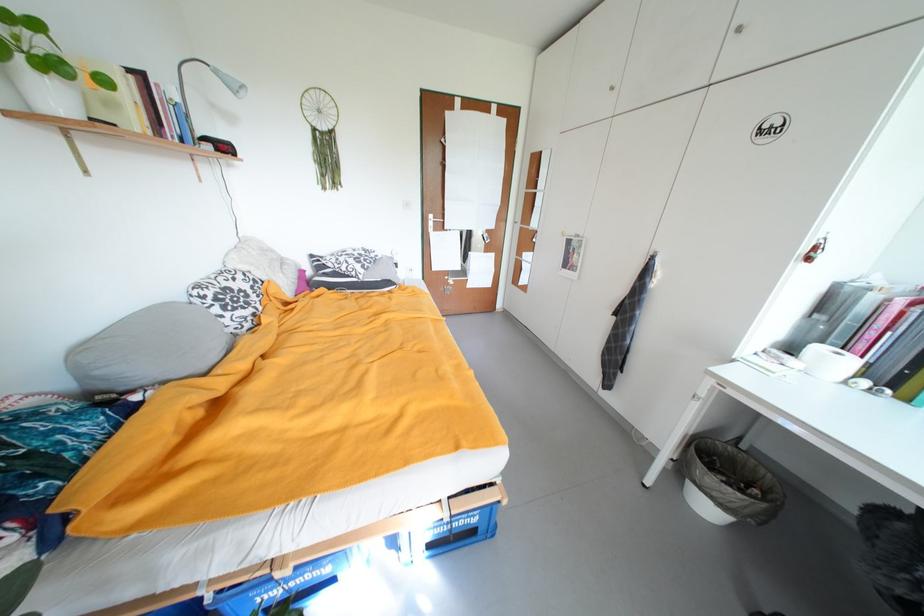
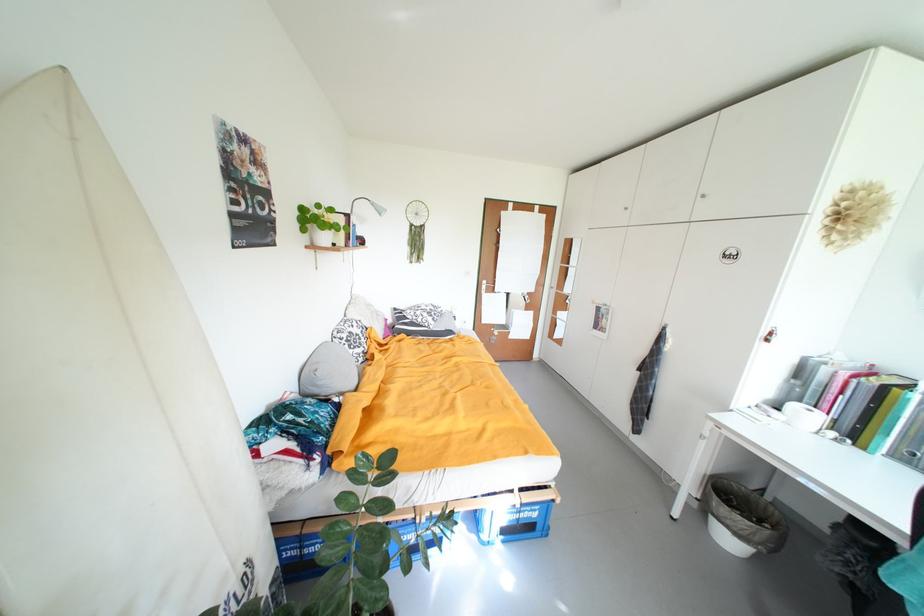
The point at (225, 74) is marked in the first image. Where is the corresponding point in the second image?

(381, 206)